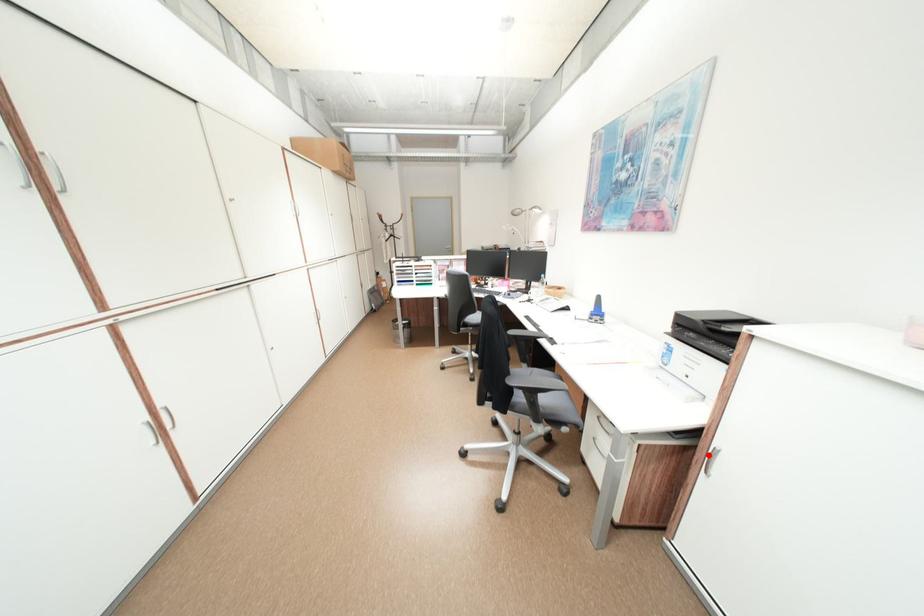
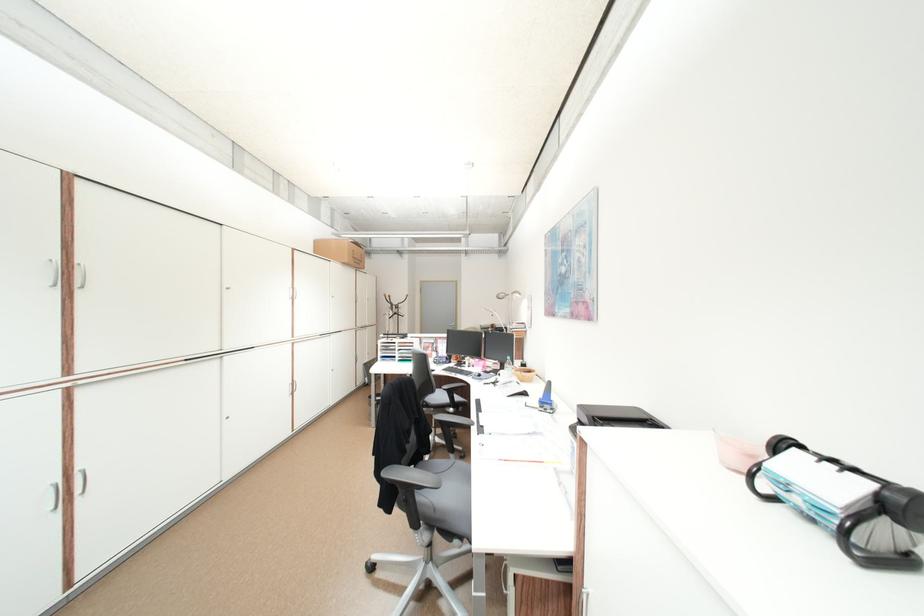
Where in the second image is the point corresponding to the highlighted location from the first image?

(584, 599)